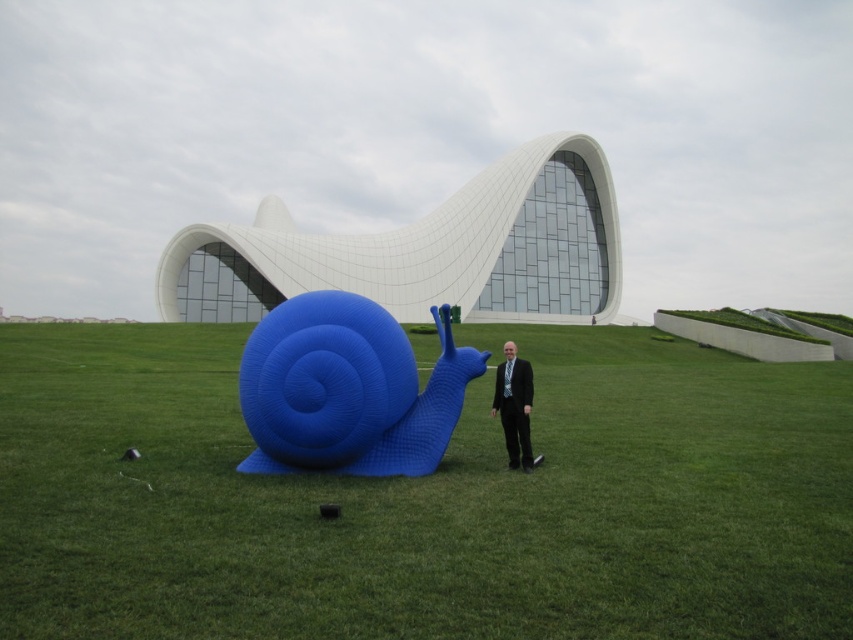
Is green grassy at center to the left of matte black suit at center from the viewer's perspective?

Yes, green grassy at center is to the left of matte black suit at center.

Is green grassy at center thinner than matte black suit at center?

No, green grassy at center is not thinner than matte black suit at center.

Between point (73, 604) and point (511, 385), which one is positioned behind?

The point (511, 385) is behind.

The height and width of the screenshot is (640, 853). Identify the location of green grassy at center. (425, 499).

Who is more distant from viewer, (x=724, y=561) or (x=416, y=266)?

The point (x=416, y=266) is behind.

Which is more to the left, green grassy at center or white smooth building at center?

From the viewer's perspective, white smooth building at center appears more on the left side.

Where is `green grassy at center`? green grassy at center is located at coordinates (425, 499).

Is blue matte snail at center below matte black suit at center?

Incorrect, blue matte snail at center is not positioned below matte black suit at center.

Can you confirm if blue matte snail at center is thinner than matte black suit at center?

Correct, blue matte snail at center's width is less than matte black suit at center's.

Between point (432, 410) and point (503, 419), which one is positioned behind?

Point (503, 419)

I want to click on blue matte snail at center, so click(347, 388).